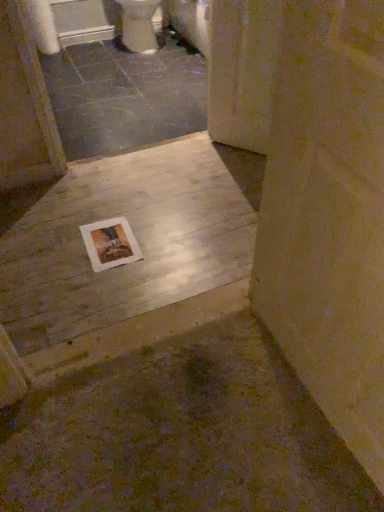
Question: Is white glossy toilet at upper center wider or thinner than wooden floor at center, which is the 2th concrete in back-to-front order?

Choices:
 (A) wide
 (B) thin

Answer: (B)

Question: From their relative heights in the image, would you say white glossy toilet at upper center is taller or shorter than wooden floor at center, which is the 2th concrete in back-to-front order?

Choices:
 (A) short
 (B) tall

Answer: (B)

Question: Estimate the real-world distances between objects in this image. Which object is closer to the white glossy toilet at upper center?

Choices:
 (A) wooden screen door at upper right
 (B) wooden floor at center, which is the 1th concrete in front-to-back order
 (C) smooth gray concrete at center, which is the 2th concrete in bottom-to-top order
 (D) white paper at upper left
 (E) white paper at center

Answer: (C)

Question: Considering the real-world distances, which object is farthest from the smooth gray concrete at center, which appears as the 1th concrete when viewed from the back?

Choices:
 (A) white paper at center
 (B) white glossy toilet at upper center
 (C) white paper at upper left
 (D) wooden floor at center, the 1th concrete from the bottom
 (E) wooden screen door at upper right

Answer: (A)